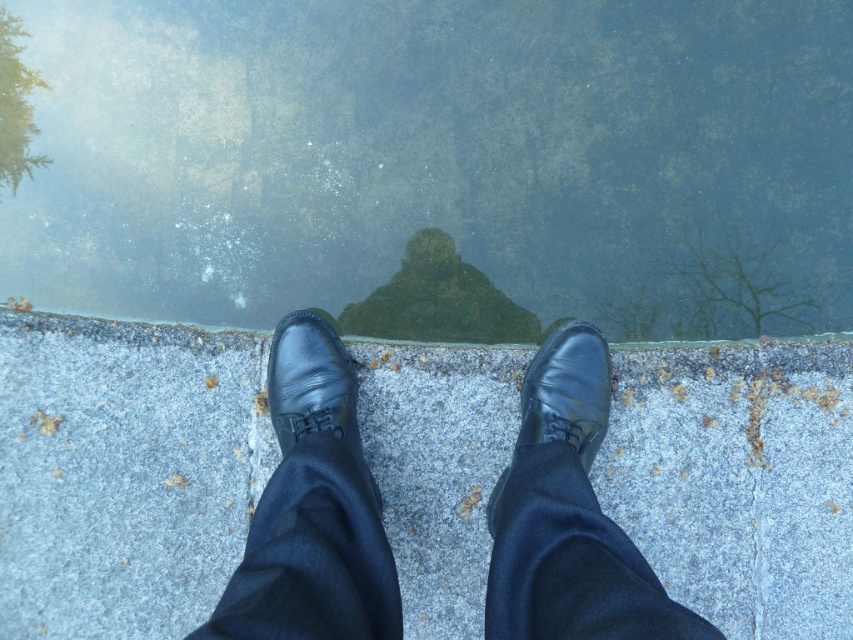
Between gray concrete at center and black leather shoe at center, which one has more height?

Standing taller between the two is gray concrete at center.

Is point (811, 339) in front of point (318, 378)?

That is False.

At what (x,y) coordinates should I click in order to perform the action: click on gray concrete at center. Please return your answer as a coordinate pair (x, y). This screenshot has height=640, width=853. Looking at the image, I should click on (125, 472).

Is black leather shoe at center below shiny black shoe at center?

Actually, black leather shoe at center is above shiny black shoe at center.

Image resolution: width=853 pixels, height=640 pixels. What do you see at coordinates (314, 388) in the screenshot?
I see `black leather shoe at center` at bounding box center [314, 388].

Measure the distance between point (335, 424) and camera.

1.57 meters

In order to click on black leather shoe at center in this screenshot , I will do `click(314, 388)`.

Based on the photo, can you confirm if gray concrete at center is taller than shiny black shoe at center?

Correct, gray concrete at center is much taller as shiny black shoe at center.

Is gray concrete at center shorter than shiny black shoe at center?

Incorrect, gray concrete at center's height does not fall short of shiny black shoe at center's.

Does point (51, 508) come in front of point (498, 506)?

No, (51, 508) is further to viewer.

The height and width of the screenshot is (640, 853). Identify the location of gray concrete at center. (125, 472).